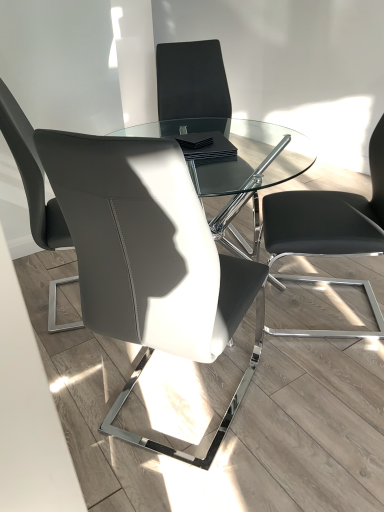
Where is `spots to the right of matte black chair at center, acting as the 2th chair starting from the left`? The image size is (384, 512). spots to the right of matte black chair at center, acting as the 2th chair starting from the left is located at coordinates (309, 406).